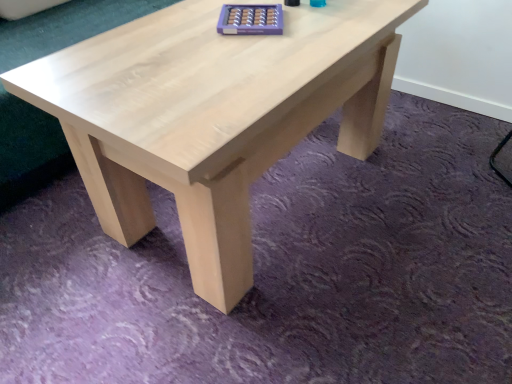
Find the location of a particular element. natural wood coffee table at center is located at coordinates (212, 115).

In order to face natural wood coffee table at center, should I rotate leftwards or rightwards?

You should look right and rotate roughly 3.098 degrees.

What do you see at coordinates (212, 115) in the screenshot? This screenshot has height=384, width=512. I see `natural wood coffee table at center` at bounding box center [212, 115].

Locate an element on the screen. The image size is (512, 384). natural wood coffee table at center is located at coordinates (212, 115).